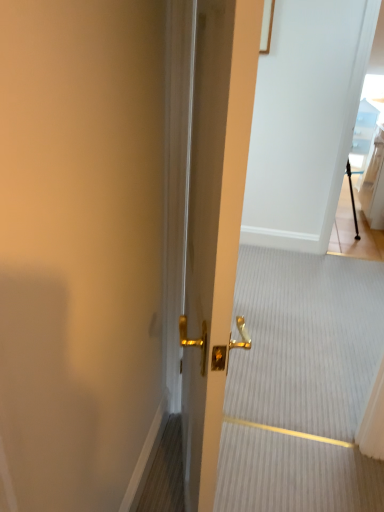
Question: Should I look upward or downward to see transparent glass door at upper right?

Choices:
 (A) up
 (B) down

Answer: (A)

Question: Is metallic gold door handle at center outside transparent glass door at upper right?

Choices:
 (A) no
 (B) yes

Answer: (B)

Question: From a real-world perspective, is metallic gold door handle at center under transparent glass door at upper right?

Choices:
 (A) yes
 (B) no

Answer: (A)

Question: Does metallic gold door handle at center have a greater height compared to transparent glass door at upper right?

Choices:
 (A) no
 (B) yes

Answer: (A)

Question: Does metallic gold door handle at center appear on the left side of transparent glass door at upper right?

Choices:
 (A) no
 (B) yes

Answer: (B)

Question: Considering the relative sizes of metallic gold door handle at center and transparent glass door at upper right in the image provided, is metallic gold door handle at center thinner than transparent glass door at upper right?

Choices:
 (A) yes
 (B) no

Answer: (B)

Question: Is metallic gold door handle at center bigger than transparent glass door at upper right?

Choices:
 (A) yes
 (B) no

Answer: (B)

Question: Can you confirm if metallic gold door handle at center is taller than gold metallic door handle at center?

Choices:
 (A) no
 (B) yes

Answer: (A)

Question: From a real-world perspective, is metallic gold door handle at center located higher than gold metallic door handle at center?

Choices:
 (A) yes
 (B) no

Answer: (B)

Question: Is the surface of metallic gold door handle at center in direct contact with gold metallic door handle at center?

Choices:
 (A) no
 (B) yes

Answer: (A)

Question: Is metallic gold door handle at center located outside gold metallic door handle at center?

Choices:
 (A) no
 (B) yes

Answer: (B)

Question: Is metallic gold door handle at center facing away from gold metallic door handle at center?

Choices:
 (A) no
 (B) yes

Answer: (A)

Question: From the image's perspective, would you say metallic gold door handle at center is shown under gold metallic door handle at center?

Choices:
 (A) no
 (B) yes

Answer: (B)

Question: Is transparent glass door at upper right wider than metallic gold door handle at center?

Choices:
 (A) yes
 (B) no

Answer: (B)